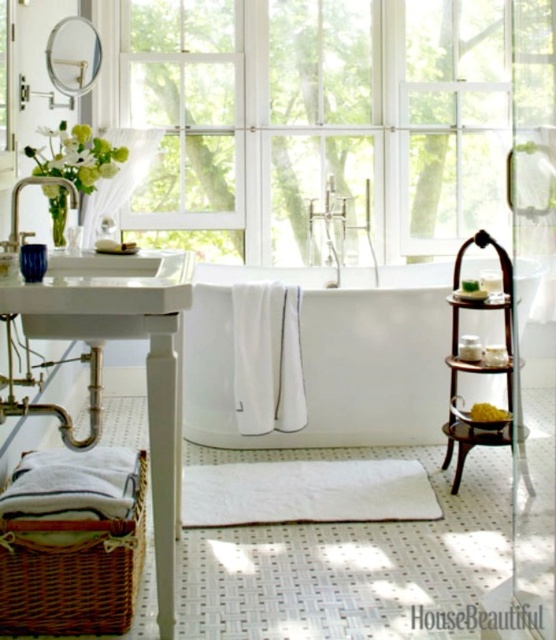
Can you confirm if white glass window at upper center is taller than wooden stool at lower right?

Yes.

Can you confirm if white glass window at upper center is smaller than wooden stool at lower right?

No, white glass window at upper center is not smaller than wooden stool at lower right.

In order to click on white glass window at upper center in this screenshot , I will do `click(317, 115)`.

Does wooden stool at lower right appear on the right side of matte silver faucet at left?

Yes, wooden stool at lower right is to the right of matte silver faucet at left.

Where is `wooden stool at lower right`? This screenshot has height=640, width=556. wooden stool at lower right is located at coordinates (471, 442).

Where is `wooden stool at lower right`? The image size is (556, 640). wooden stool at lower right is located at coordinates (471, 442).

Does white glass window at upper center have a greater width compared to white glossy bathtub at center?

Correct, the width of white glass window at upper center exceeds that of white glossy bathtub at center.

Can you confirm if white glass window at upper center is shorter than white glossy bathtub at center?

In fact, white glass window at upper center may be taller than white glossy bathtub at center.

Locate an element on the screen. This screenshot has width=556, height=640. white glass window at upper center is located at coordinates (317, 115).